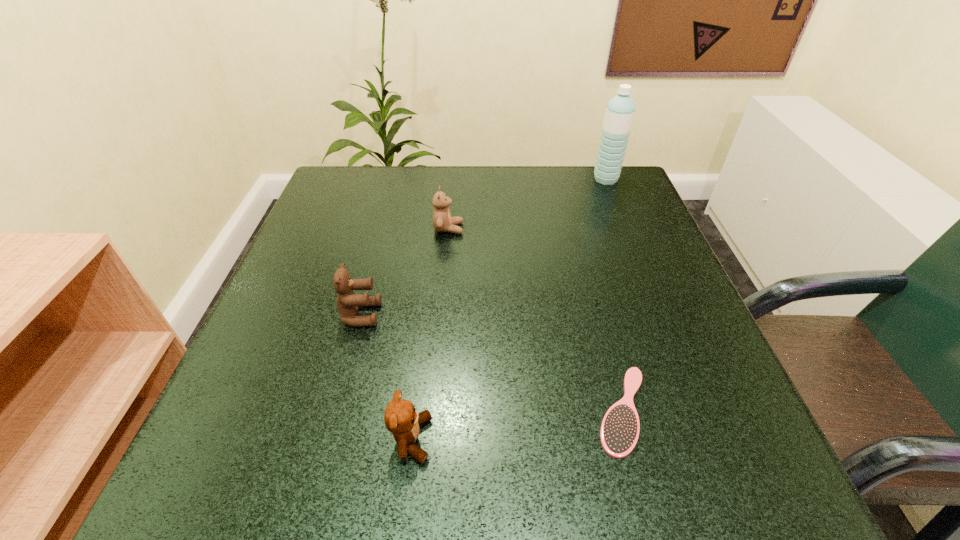
Where is `free location located on the front-facing side of the fourth nearest object`? free location located on the front-facing side of the fourth nearest object is located at coordinates (581, 228).

Where is `vacant space located 0.060m on the front-facing side of the nearest teddy bear`? This screenshot has width=960, height=540. vacant space located 0.060m on the front-facing side of the nearest teddy bear is located at coordinates (473, 439).

You are a GUI agent. You are given a task and a screenshot of the screen. Output one action in this format:
    pyautogui.click(x=<x>, y=<y>)
    Task: Click on the vacant region located on the back of the shortest object
    The height and width of the screenshot is (540, 960).
    Given the screenshot: What is the action you would take?
    pyautogui.click(x=590, y=286)

Where is `water bottle located in the far edge section of the desktop`? Image resolution: width=960 pixels, height=540 pixels. water bottle located in the far edge section of the desktop is located at coordinates (620, 110).

Image resolution: width=960 pixels, height=540 pixels. In order to click on teddy bear present at the far edge in this screenshot , I will do `click(442, 221)`.

I want to click on teddy bear that is at the near edge, so click(x=400, y=418).

The height and width of the screenshot is (540, 960). I want to click on hairbrush located in the near edge section of the desktop, so click(619, 432).

What are the coordinates of `object that is at the left edge` in the screenshot? It's located at (347, 301).

Identify the location of water bottle located in the right edge section of the desktop. (620, 110).

Where is `hairbrush that is at the right edge`? This screenshot has width=960, height=540. hairbrush that is at the right edge is located at coordinates (619, 432).